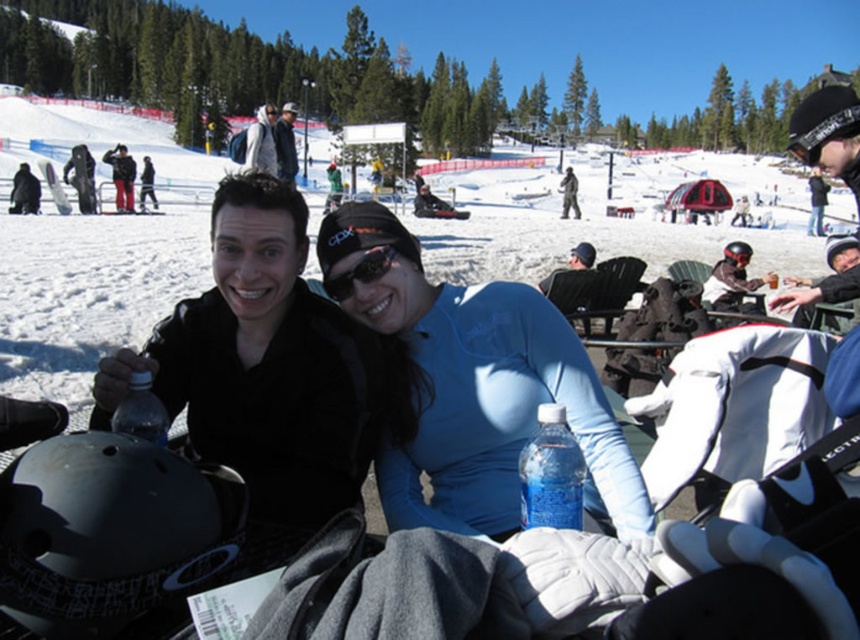
Question: From the image, what is the correct spatial relationship of blue plastic bottle at center in relation to transparent plastic bottle at lower left?

Choices:
 (A) right
 (B) left

Answer: (A)

Question: Does blue plastic bottle at center have a smaller size compared to dark blue jacket at center?

Choices:
 (A) no
 (B) yes

Answer: (B)

Question: Which object is positioned closest to the blue plastic bottle at center?

Choices:
 (A) blue fleece jacket at center
 (B) dark blue jacket at center

Answer: (A)

Question: Estimate the real-world distances between objects in this image. Which object is farther from the blue plastic bottle at center?

Choices:
 (A) sunglasses at center
 (B) transparent plastic bottle at lower left

Answer: (B)

Question: Is transparent plastic bottle at lower left thinner than dark blue jacket at center?

Choices:
 (A) no
 (B) yes

Answer: (B)

Question: Which point is farther from the camera taking this photo?

Choices:
 (A) (287, 131)
 (B) (379, 248)
 (C) (564, 461)

Answer: (A)